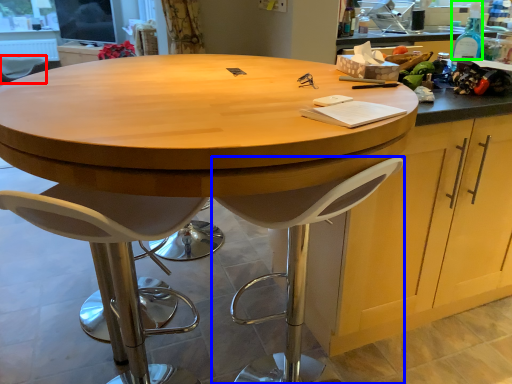
Question: Which object is the farthest from chair (highlighted by a red box)? Choose among these: stool (highlighted by a blue box) or bottle (highlighted by a green box).

Choices:
 (A) stool
 (B) bottle

Answer: (B)